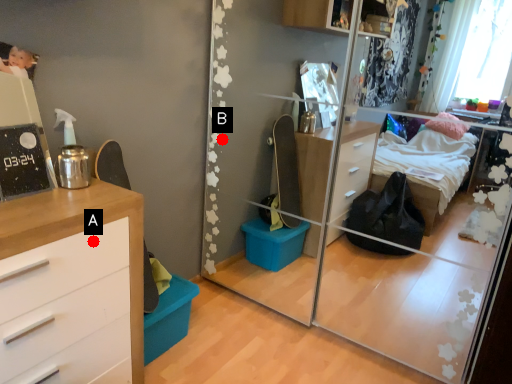
Question: Two points are circled on the image, labeled by A and B beside each circle. Which point is closer to the camera?

Choices:
 (A) A is closer
 (B) B is closer

Answer: (A)